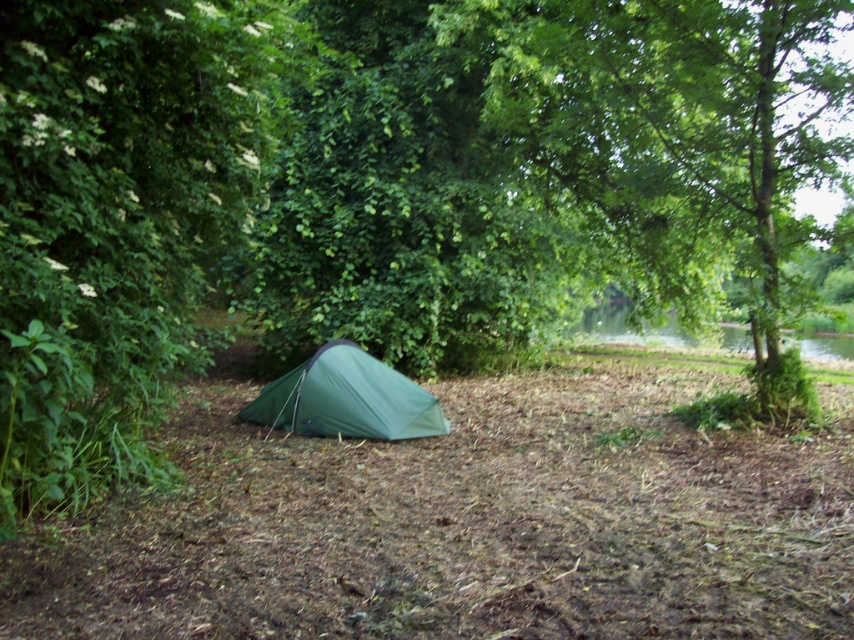
Is green leafy tree at center closer to the viewer compared to green fabric tent at center?

No, green leafy tree at center is further to the viewer.

Can you confirm if green leafy tree at center is positioned to the left of green fabric tent at center?

No, green leafy tree at center is not to the left of green fabric tent at center.

Is point (758, 61) less distant than point (303, 368)?

Yes, it is in front of point (303, 368).

Identify the location of green leafy tree at center. The width and height of the screenshot is (854, 640). [x=680, y=138].